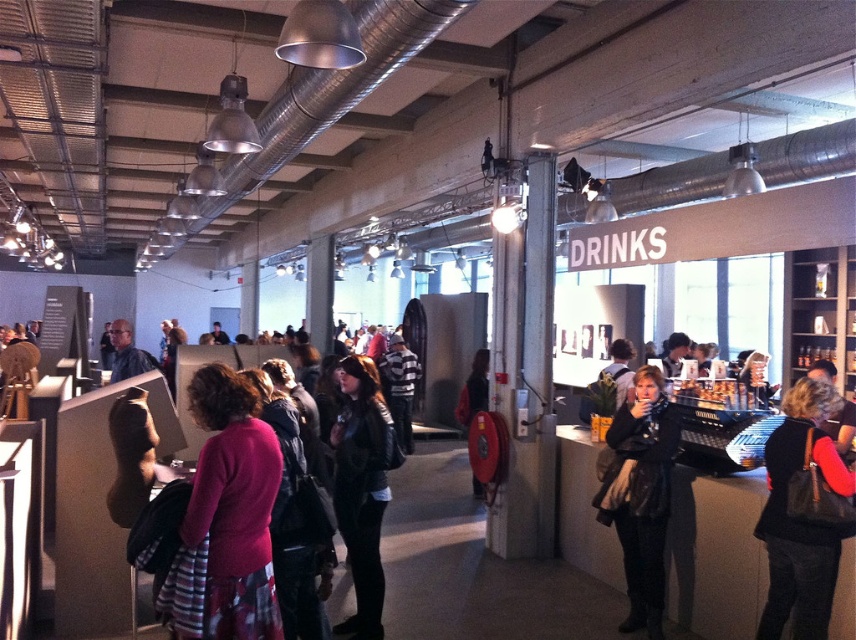
You are at the event and want to pick up your black leather handbag at lower right. You are currently standing near the pink matte sweater at center. Which direction should you move to reach your handbag?

The black leather handbag at lower right is further away from the viewer compared to the pink matte sweater at center, so you should move forward towards it.

You are at the point labeled point (x=236, y=406) and want to walk to the exit located at point (x=762, y=528). Is there a clear path between these two points without any obstacles?

Point (x=236, y=406) is in front of point (x=762, y=528), so there might be an obstacle between them. You should check the path carefully before proceeding.